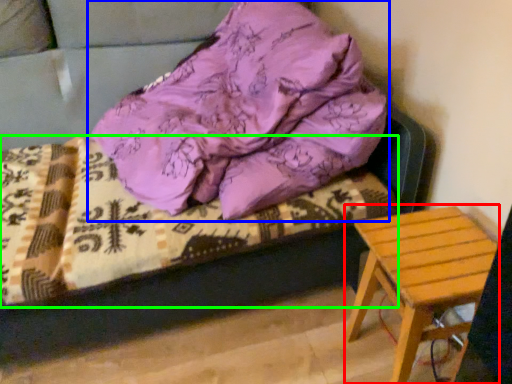
Question: Which object is positioned farthest from stool (highlighted by a red box)? Select from pillow (highlighted by a blue box) and bedding (highlighted by a green box).

Choices:
 (A) pillow
 (B) bedding

Answer: (A)